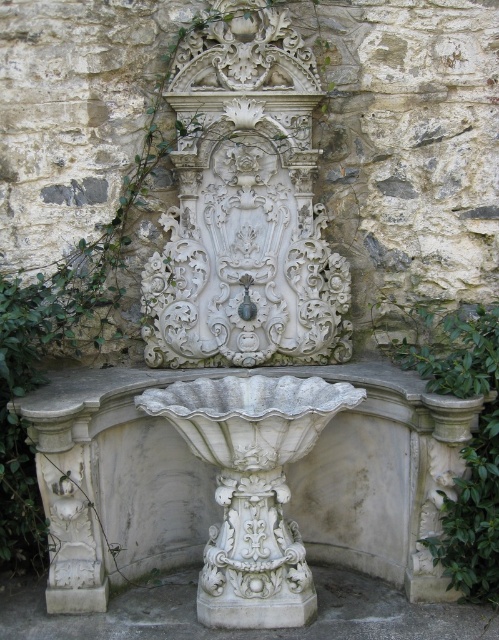
Is white stone pedestal at center to the right of green leafy ivy at right from the viewer's perspective?

Incorrect, white stone pedestal at center is not on the right side of green leafy ivy at right.

At what (x,y) coordinates should I click in order to perform the action: click on white stone pedestal at center. Please return your answer as a coordinate pair (x, y). The image size is (499, 640). Looking at the image, I should click on (244, 628).